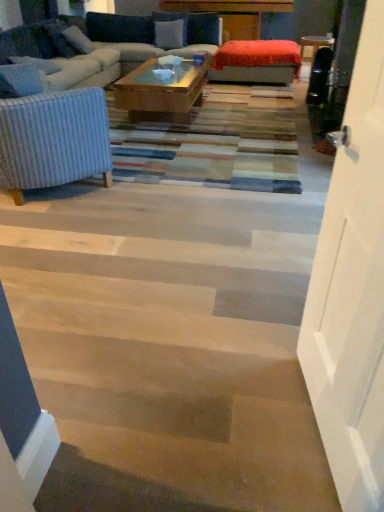
Question: Which direction should I rotate to face blue fabric pillow at upper center, the fourth pillow when ordered from bottom to top, — up or down?

Choices:
 (A) down
 (B) up

Answer: (B)

Question: Is white fabric pillow at upper left, marked as the third pillow in a back-to-front arrangement, located outside white wood door at right?

Choices:
 (A) no
 (B) yes

Answer: (B)

Question: Does white fabric pillow at upper left, marked as the third pillow in a back-to-front arrangement, appear on the left side of white wood door at right?

Choices:
 (A) no
 (B) yes

Answer: (B)

Question: Is white fabric pillow at upper left, the second pillow ordered from the bottom, turned away from white wood door at right?

Choices:
 (A) no
 (B) yes

Answer: (A)

Question: From the image's perspective, is white fabric pillow at upper left, marked as the third pillow in a back-to-front arrangement, located above white wood door at right?

Choices:
 (A) yes
 (B) no

Answer: (A)

Question: Does white fabric pillow at upper left, the second pillow ordered from the bottom, turn towards white wood door at right?

Choices:
 (A) no
 (B) yes

Answer: (A)

Question: Is white fabric pillow at upper left, which is the second pillow from front to back, at the right side of white wood door at right?

Choices:
 (A) no
 (B) yes

Answer: (A)

Question: Considering the relative sizes of velvet blue couch at upper left and white wood door at right in the image provided, is velvet blue couch at upper left wider than white wood door at right?

Choices:
 (A) no
 (B) yes

Answer: (B)

Question: Would you consider velvet blue couch at upper left to be distant from white wood door at right?

Choices:
 (A) yes
 (B) no

Answer: (A)

Question: Does velvet blue couch at upper left have a lesser height compared to white wood door at right?

Choices:
 (A) yes
 (B) no

Answer: (A)

Question: Does velvet blue couch at upper left turn towards white wood door at right?

Choices:
 (A) no
 (B) yes

Answer: (A)

Question: Is velvet blue couch at upper left looking in the opposite direction of white wood door at right?

Choices:
 (A) yes
 (B) no

Answer: (B)

Question: Is velvet blue couch at upper left to the left of white wood door at right from the viewer's perspective?

Choices:
 (A) no
 (B) yes

Answer: (B)

Question: Is the position of white wood door at right more distant than that of velvet blue pillow at upper center, acting as the second pillow starting from the back?

Choices:
 (A) yes
 (B) no

Answer: (B)